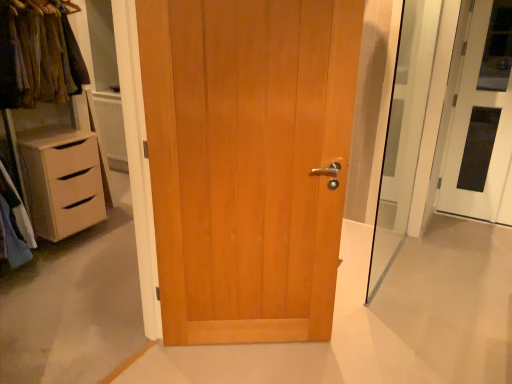
Locate an element on the screen. The width and height of the screenshot is (512, 384). vacant space underneath light brown wood door at center, the 2th door from the right (from a real-world perspective) is located at coordinates (243, 347).